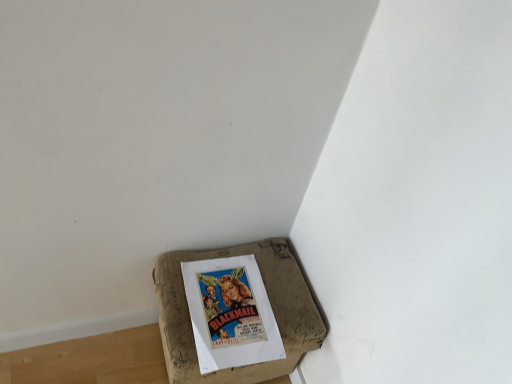
I want to click on vacant space underneath vintage paper poster at bottom corner (from a real-world perspective), so click(233, 307).